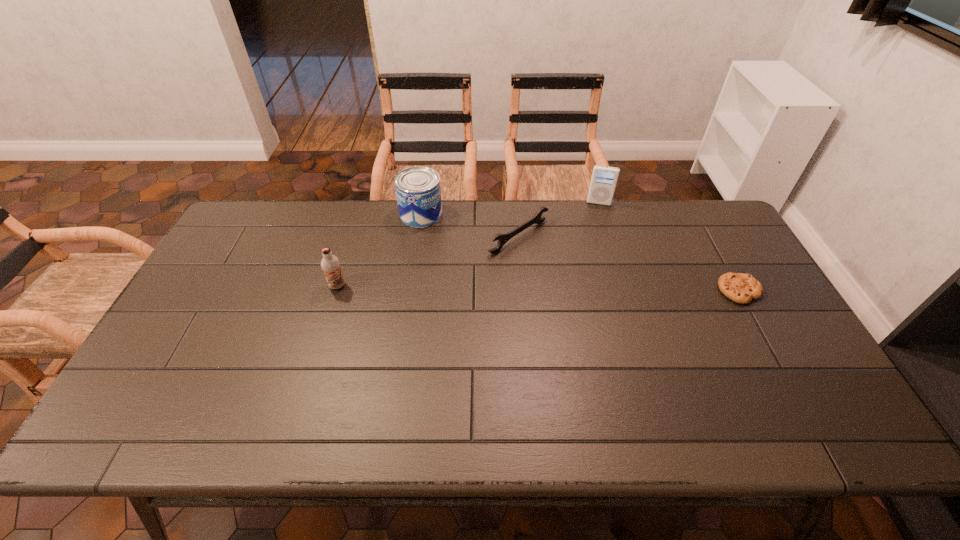
At what (x,y) coordinates should I click in order to perform the action: click on free space between the cookie and the fourth tallest object. Please return your answer as a coordinate pair (x, y). The width and height of the screenshot is (960, 540). Looking at the image, I should click on (629, 264).

Find the location of a particular element. The image size is (960, 540). free spot between the third object from left to right and the second object from left to right is located at coordinates (469, 226).

Identify the location of free space between the cookie and the leftmost object. This screenshot has height=540, width=960. (539, 288).

I want to click on empty space between the can and the chocolate milk, so click(x=379, y=250).

The image size is (960, 540). Identify the location of empty location between the leftmost object and the third object from right to left. (428, 261).

I want to click on free area in between the iPod and the cookie, so click(669, 247).

Identify which object is the fourth nearest to the iPod. Please provide its 2D coordinates. Your answer should be formatted as a tuple, i.e. [(x, y)], where the tuple contains the x and y coordinates of a point satisfying the conditions above.

[(330, 264)]

Select which object is the fourth closest to the second object from right to left. Please provide its 2D coordinates. Your answer should be formatted as a tuple, i.e. [(x, y)], where the tuple contains the x and y coordinates of a point satisfying the conditions above.

[(330, 264)]

The image size is (960, 540). Find the location of `vacant position in the image that satisfies the following two spatial constraints: 1. on the front side of the shortest object; 2. on the right side of the third object from right to left`. vacant position in the image that satisfies the following two spatial constraints: 1. on the front side of the shortest object; 2. on the right side of the third object from right to left is located at coordinates (523, 291).

This screenshot has width=960, height=540. In order to click on vacant area that satisfies the following two spatial constraints: 1. on the back side of the fourth tallest object; 2. on the left side of the chocolate milk in this screenshot , I will do `click(352, 237)`.